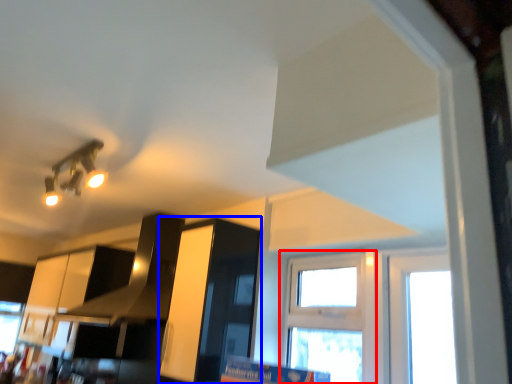
Question: Among these objects, which one is farthest to the camera, window (highlighted by a red box) or cabinetry (highlighted by a blue box)?

Choices:
 (A) window
 (B) cabinetry

Answer: (A)